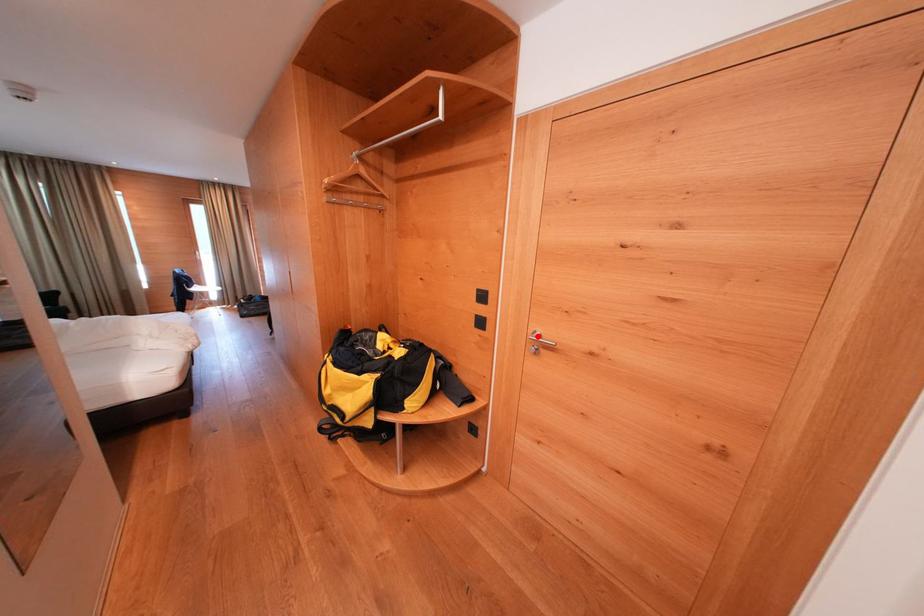
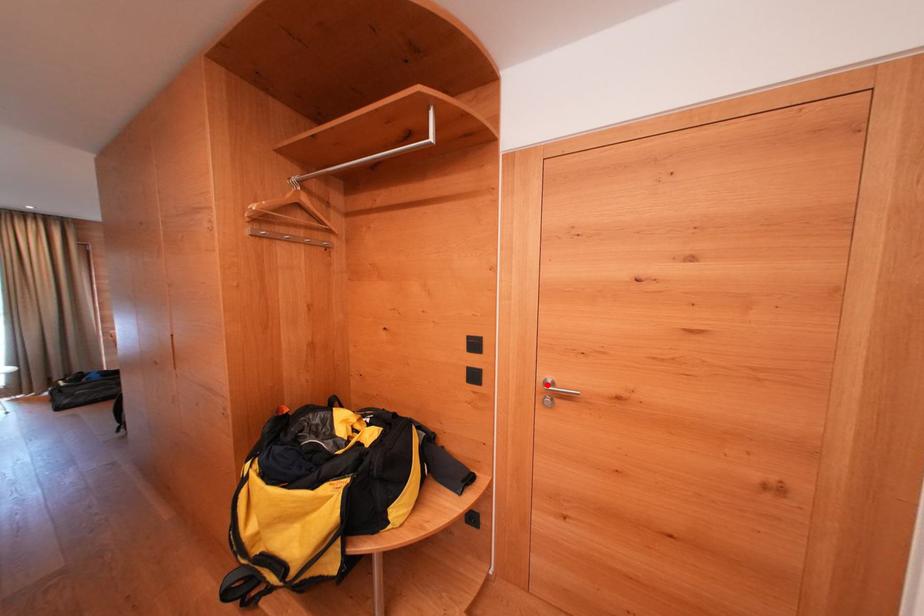
I am providing you with two images of the same scene from different viewpoints. A red point is marked on the first image and another point is marked on the second image. Is the red point in image1 aligned with the point shown in image2?

Yes